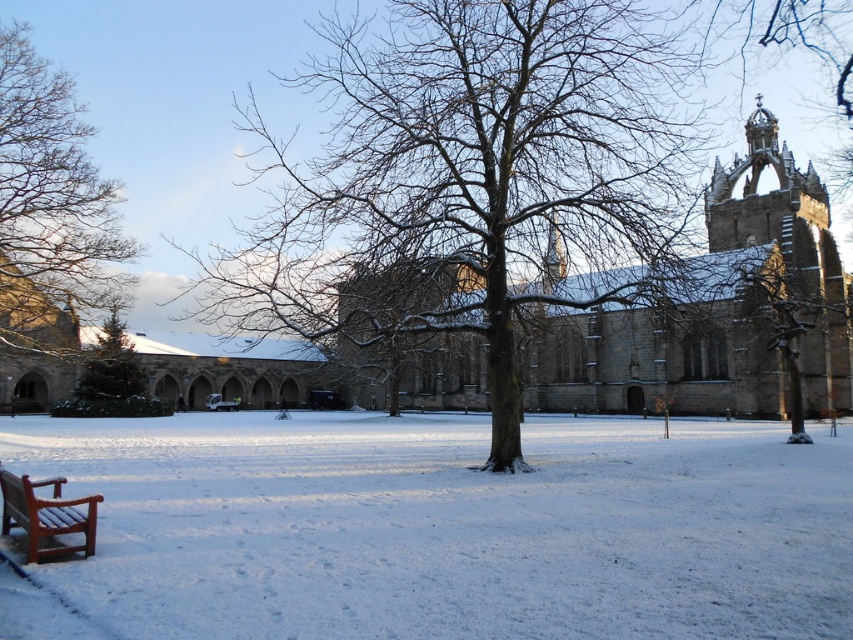
You are standing in the winter scene and want to take a photo of the brown stone church at center and the bare wood tree at left. From your current position, which object is closer to the left edge of your camera frame?

The bare wood tree at left is closer to the left edge of the camera frame because the brown stone church at center is positioned on the right side of it.

You are an artist trying to sketch this winter scene. You want to ensure the proportions are accurate. Which object, the smooth brown tree trunk at right or the wooden park bench at lower left, should you draw wider to maintain the correct scale?

The smooth brown tree trunk at right should be drawn wider since its width is larger than the wooden park bench at lower left.

In the scene shown: You are an artist setting up your easel to paint the winter scene. You want to position your easel so that both the smooth brown tree trunk at right and the wooden park bench at lower left are visible in your view. Based on their positions, which object will appear higher in your painting?

The smooth brown tree trunk at right appears higher in the painting because it is located above the wooden park bench at lower left.